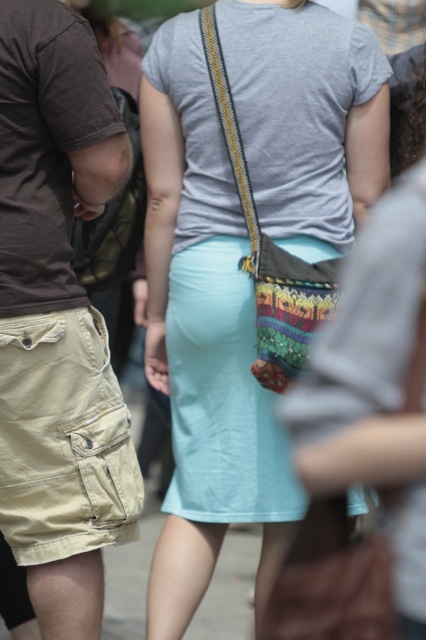
Looking at this image, is textured fabric skirt at center taller than multicolored woven bag at center?

Indeed, textured fabric skirt at center has a greater height compared to multicolored woven bag at center.

Is textured fabric skirt at center to the left of multicolored woven bag at center from the viewer's perspective?

Correct, you'll find textured fabric skirt at center to the left of multicolored woven bag at center.

Does point (321, 90) come in front of point (267, 355)?

No, it is behind (267, 355).

At what (x,y) coordinates should I click in order to perform the action: click on textured fabric skirt at center. Please return your answer as a coordinate pair (x, y). This screenshot has width=426, height=640. Looking at the image, I should click on (203, 340).

Does tan/cotton shorts at left have a lesser width compared to multicolored woven bag at center?

No, tan/cotton shorts at left is not thinner than multicolored woven bag at center.

Which is in front, point (80, 358) or point (305, 307)?

Point (80, 358)

Measure the distance between tan/cotton shorts at left and camera.

tan/cotton shorts at left is 4.31 meters away from camera.

At what (x,y) coordinates should I click in order to perform the action: click on tan/cotton shorts at left. Please return your answer as a coordinate pair (x, y). Looking at the image, I should click on (63, 440).

The image size is (426, 640). What do you see at coordinates (203, 340) in the screenshot?
I see `textured fabric skirt at center` at bounding box center [203, 340].

Who is more distant from viewer, (x=195, y=392) or (x=17, y=362)?

Point (x=195, y=392)

Identify the location of textured fabric skirt at center. (203, 340).